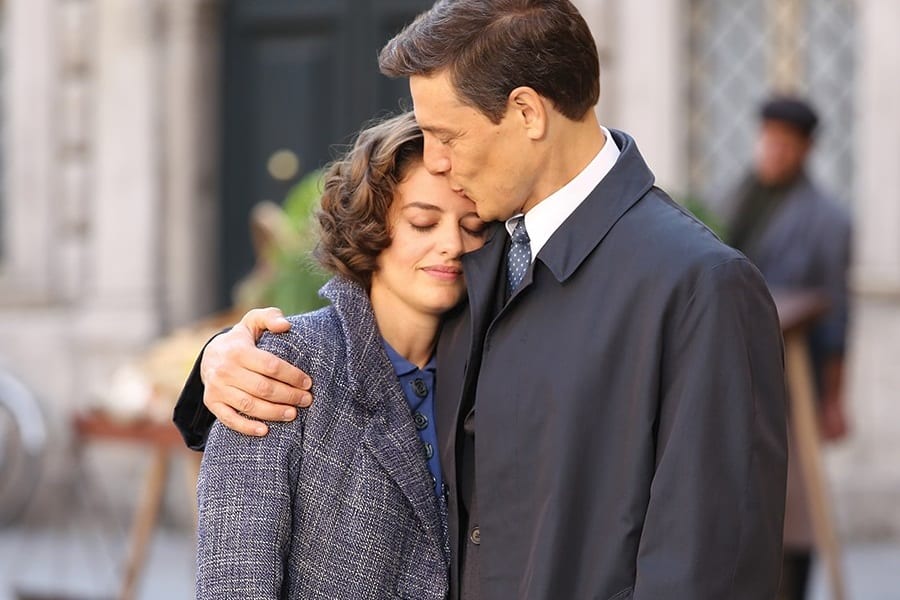
This screenshot has height=600, width=900. Find the location of `window`. window is located at coordinates (739, 65).